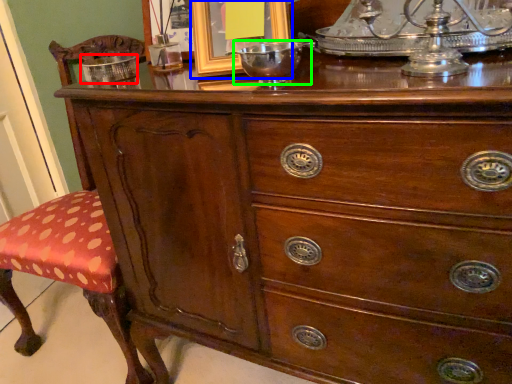
Question: Which object is the farthest from bowl (highlighted by a red box)? Choose among these: picture frame (highlighted by a blue box) or glass bowl (highlighted by a green box).

Choices:
 (A) picture frame
 (B) glass bowl

Answer: (B)